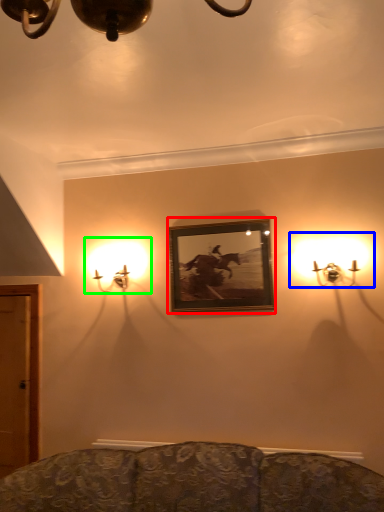
Question: Which is farther away from picture frame (highlighted by a red box)? lamp (highlighted by a blue box) or lamp (highlighted by a green box)?

Choices:
 (A) lamp
 (B) lamp

Answer: (B)